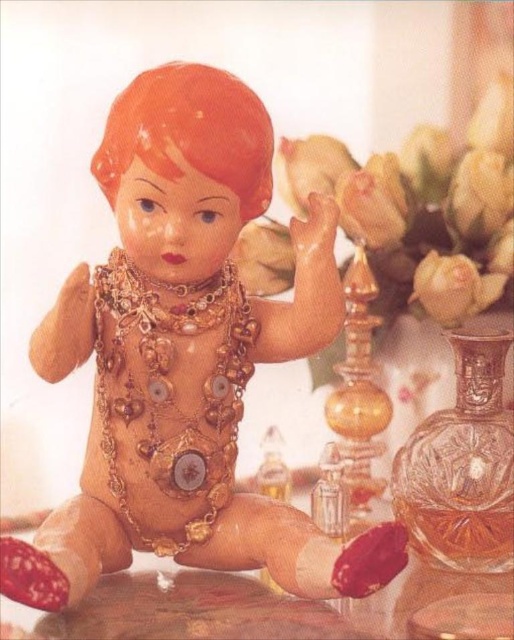
Who is lower down, matte gold doll at center or smooth wooden table at center?

smooth wooden table at center is lower down.

At what (x,y) coordinates should I click in order to perform the action: click on matte gold doll at center. Please return your answer as a coordinate pair (x, y). The height and width of the screenshot is (640, 514). Looking at the image, I should click on (186, 356).